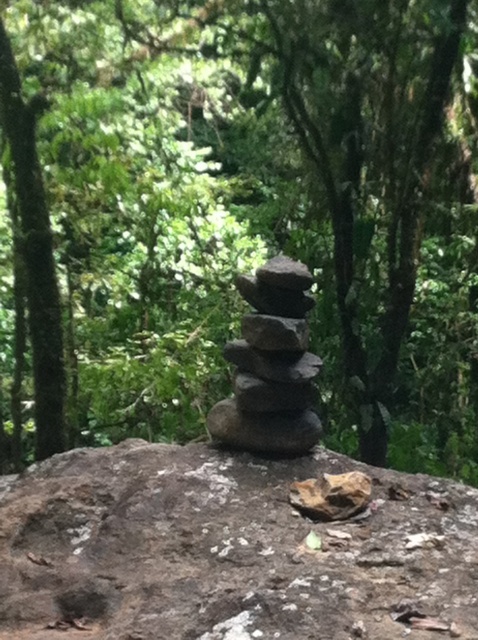
Is green leafy tree at center smaller than brown rough rock at center?

No, green leafy tree at center is not smaller than brown rough rock at center.

The width and height of the screenshot is (478, 640). What do you see at coordinates (260, 204) in the screenshot? I see `green leafy tree at center` at bounding box center [260, 204].

Who is more forward, (358, 74) or (344, 621)?

Point (344, 621) is more forward.

Identify the location of green leafy tree at center. (260, 204).

Does brown rough rock at center appear over smooth gray rock at center?

Actually, brown rough rock at center is below smooth gray rock at center.

Does point (79, 636) lie behind point (265, 419)?

No, (79, 636) is closer to viewer.

At what (x,y) coordinates should I click in order to perform the action: click on brown rough rock at center. Please return your answer as a coordinate pair (x, y). This screenshot has height=640, width=478. Looking at the image, I should click on (228, 550).

Is green leafy tree at center positioned at the back of smooth gray rock at center?

Result: Yes, it is behind smooth gray rock at center.

Is green leafy tree at center shorter than smooth gray rock at center?

No.

Who is more distant from viewer, (204, 116) or (239, 403)?

The point (204, 116) is behind.

In order to click on green leafy tree at center in this screenshot , I will do `click(260, 204)`.